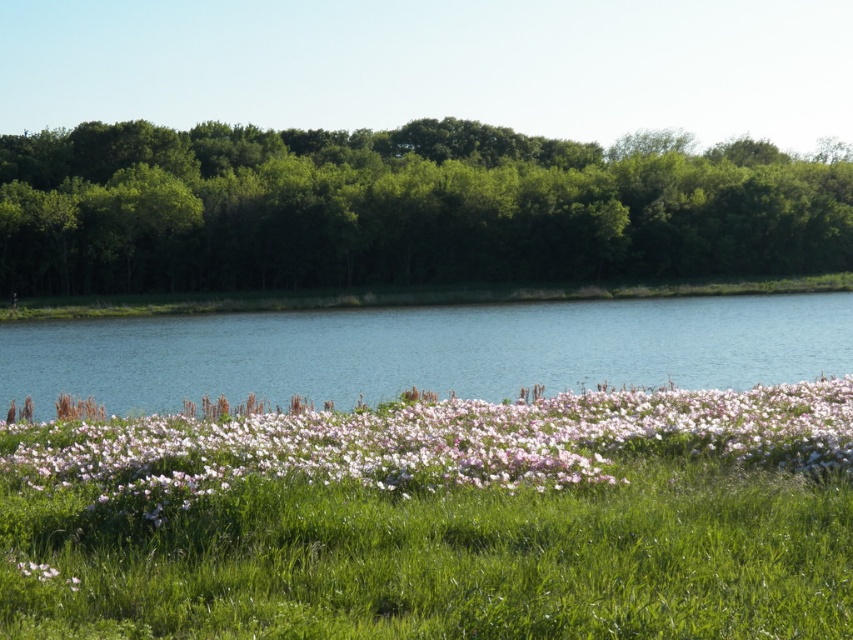
You are an artist planning to paint this landscape. You want to ensure the green leafy trees at upper center and the blue water at center are proportionally accurate. Which object should you paint first if you want to start with the larger one?

The green leafy trees at upper center should be painted first since they are larger than the blue water at center according to the description.

You are standing in the flower field and want to know which area is wider when looking at the green leafy trees at upper center and the pink matte flowers at center. Which one is wider?

The green leafy trees at upper center are wider than the pink matte flowers at center according to the description.

You are a photographer planning to capture the entire scene in one shot. Given that your camera can only focus on objects within a 5 meter width, will the blue water at center and the pink matte flowers at center fit within the frame without overlapping?

The blue water at center might be wider than pink matte flowers at center, so there is a possibility that the blue water at center could exceed the 5 meter width limit, causing overlap or exclusion in the frame.